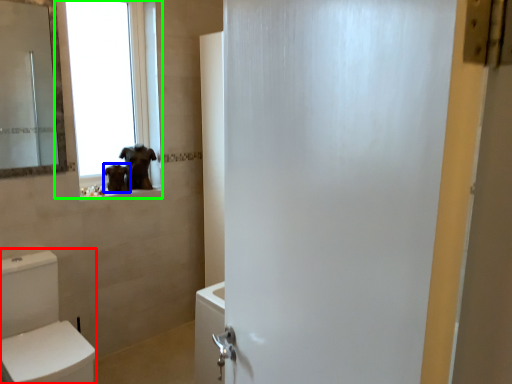
Question: Which object is the farthest from toilet bowl (highlighted by a red box)? Choose among these: animal (highlighted by a blue box) or window (highlighted by a green box).

Choices:
 (A) animal
 (B) window

Answer: (B)